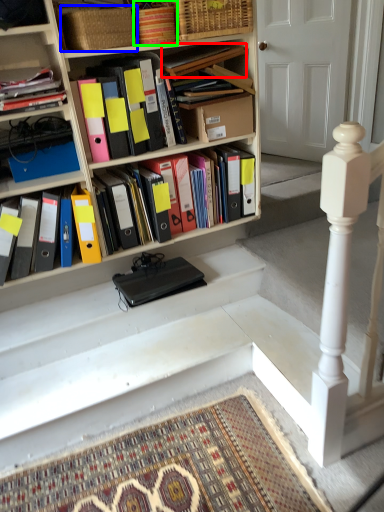
Question: Which object is the farthest from book (highlighted by a red box)? Choose among these: basket (highlighted by a blue box) or crate (highlighted by a green box).

Choices:
 (A) basket
 (B) crate

Answer: (A)